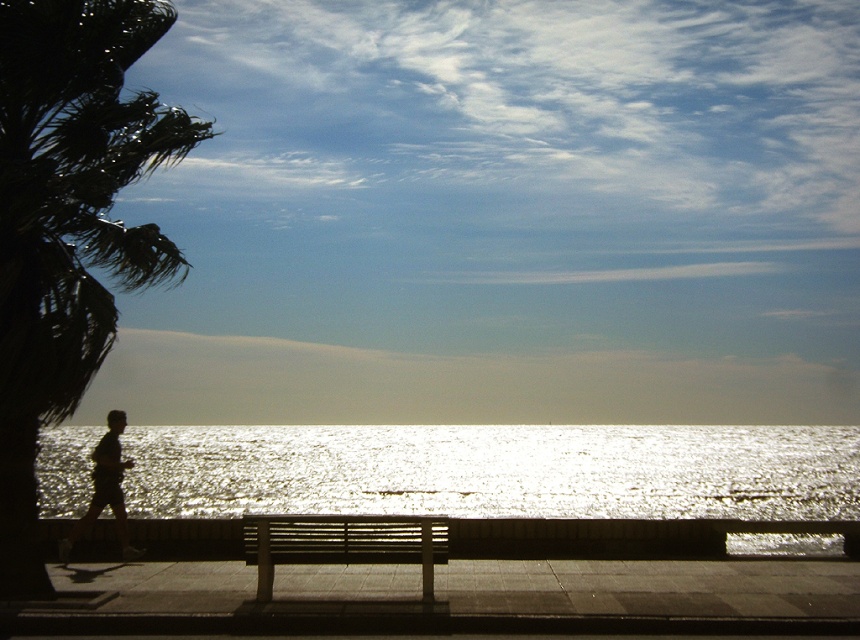
Between glistening silver water at center and green leafy palm tree at left, which one has less height?

With less height is glistening silver water at center.

Is glistening silver water at center to the right of green leafy palm tree at left from the viewer's perspective?

Yes, glistening silver water at center is to the right of green leafy palm tree at left.

Is point (754, 438) positioned before point (4, 340)?

No, it is not.

In order to click on glistening silver water at center in this screenshot , I will do `click(495, 470)`.

Is glistening silver water at center above wooden slats bench at center?

Actually, glistening silver water at center is below wooden slats bench at center.

Does glistening silver water at center appear under wooden slats bench at center?

Correct, glistening silver water at center is located below wooden slats bench at center.

The image size is (860, 640). Identify the location of glistening silver water at center. (495, 470).

Which is more to the right, green leafy palm tree at left or wooden slats bench at center?

From the viewer's perspective, wooden slats bench at center appears more on the right side.

What do you see at coordinates (68, 224) in the screenshot? This screenshot has width=860, height=640. I see `green leafy palm tree at left` at bounding box center [68, 224].

Is point (97, 266) positioned behind point (332, 529)?

Yes.

The image size is (860, 640). In order to click on green leafy palm tree at left in this screenshot , I will do `click(68, 224)`.